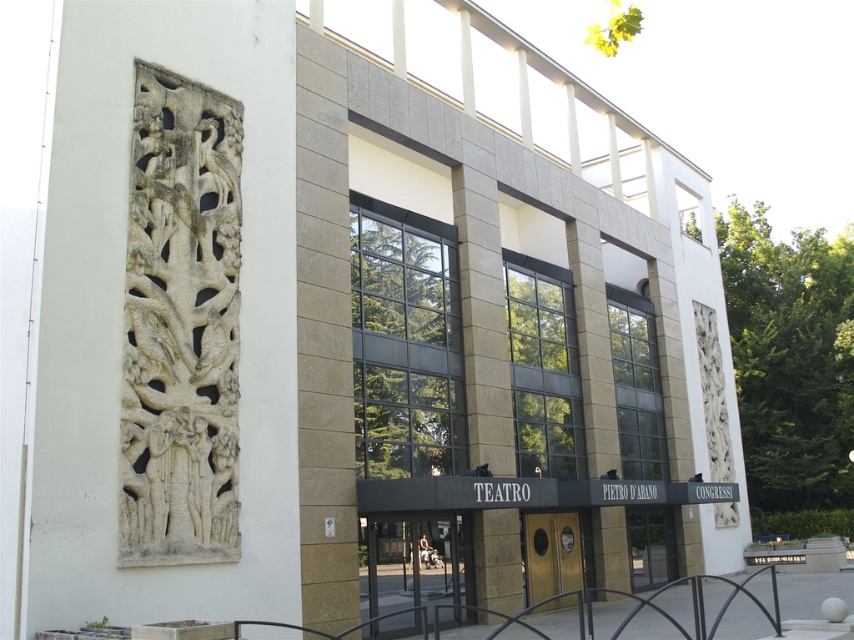
Can you confirm if white stone carving at left is positioned to the right of green leafy tree at right?

No, white stone carving at left is not to the right of green leafy tree at right.

Is point (145, 13) closer to camera compared to point (767, 355)?

Yes, point (145, 13) is in front of point (767, 355).

You are a GUI agent. You are given a task and a screenshot of the screen. Output one action in this format:
    pyautogui.click(x=<x>, y=<y>)
    Task: Click on the white stone carving at left
    This screenshot has height=640, width=854.
    Given the screenshot: What is the action you would take?
    pyautogui.click(x=142, y=298)

The width and height of the screenshot is (854, 640). What are the coordinates of `white stone carving at left` in the screenshot? It's located at (142, 298).

Does green leafy tree at center have a larger size compared to gold metallic door at center?

Yes.

Measure the distance from green leafy tree at center to gold metallic door at center.

green leafy tree at center and gold metallic door at center are 14.82 feet apart from each other.

Which is behind, point (436, 355) or point (536, 611)?

The point (536, 611) is behind.

You are a GUI agent. You are given a task and a screenshot of the screen. Output one action in this format:
    pyautogui.click(x=<x>, y=<y>)
    Task: Click on the green leafy tree at center
    The width and height of the screenshot is (854, 640).
    Given the screenshot: What is the action you would take?
    pyautogui.click(x=404, y=353)

Looking at this image, is white stone carving at left positioned before green leafy tree at center?

Yes, it is.

You are a GUI agent. You are given a task and a screenshot of the screen. Output one action in this format:
    pyautogui.click(x=<x>, y=<y>)
    Task: Click on the white stone carving at left
    The width and height of the screenshot is (854, 640).
    Given the screenshot: What is the action you would take?
    pyautogui.click(x=142, y=298)